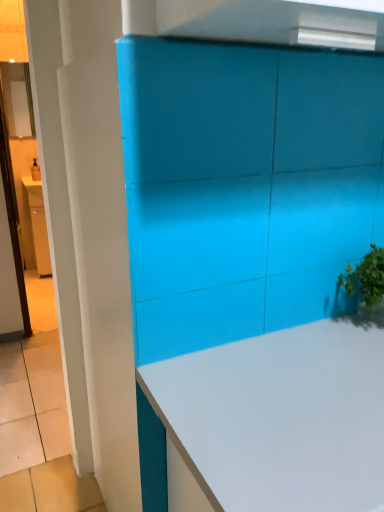
What is the approximate height of white glossy countertop at center?

It is 34.00 inches.

The image size is (384, 512). Describe the element at coordinates (279, 418) in the screenshot. I see `white glossy countertop at center` at that location.

Locate an element on the screen. The image size is (384, 512). white glossy countertop at center is located at coordinates (279, 418).

Identify the location of white glossy countertop at center. (279, 418).